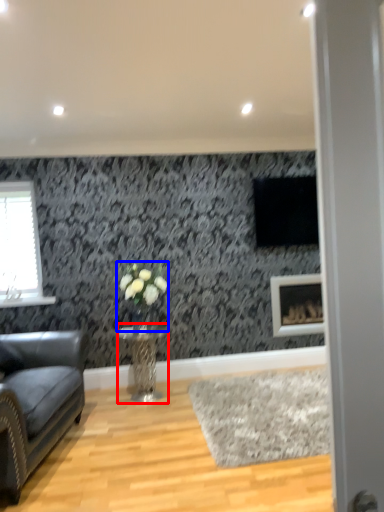
Question: Which object appears closest to the camera in this image, table (highlighted by a red box) or floral arrangement (highlighted by a blue box)?

Choices:
 (A) table
 (B) floral arrangement

Answer: (A)